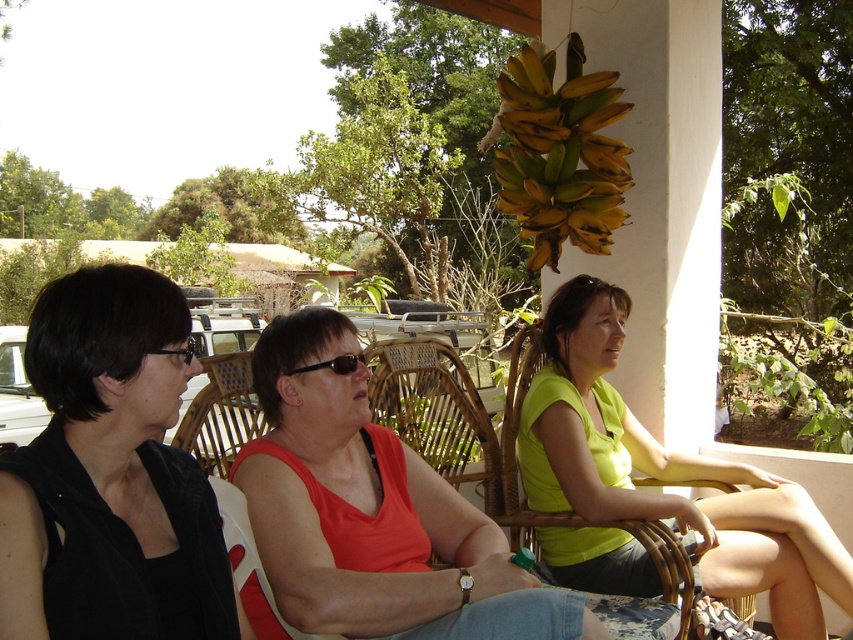
Question: Among these objects, which one is nearest to the camera?

Choices:
 (A) black plastic glasses at center
 (B) matte orange tank top at center
 (C) matte green shirt at center
 (D) yellow-green matte bananas at upper center

Answer: (A)

Question: Which point is closer to the camera?

Choices:
 (A) yellow-green matte bananas at upper center
 (B) black plastic glasses at center
 (C) matte green shirt at center

Answer: (B)

Question: Which point is closer to the camera?

Choices:
 (A) black plastic glasses at center
 (B) woven rattan chair at center
 (C) matte green shirt at center

Answer: (A)

Question: Is matte green shirt at center in front of black plastic glasses at center?

Choices:
 (A) yes
 (B) no

Answer: (B)

Question: Where is matte orange tank top at center located in relation to matte green shirt at center in the image?

Choices:
 (A) above
 (B) below

Answer: (A)

Question: Is black matte shirt at left to the left of yellow-green matte bananas at upper center from the viewer's perspective?

Choices:
 (A) no
 (B) yes

Answer: (B)